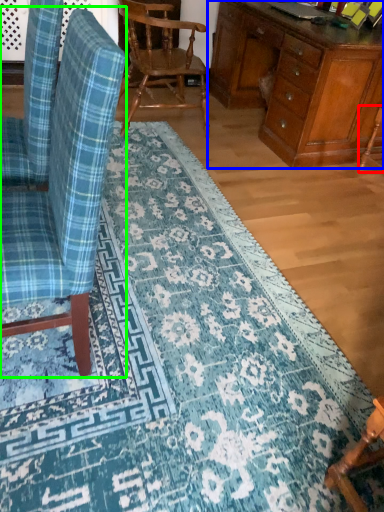
Question: Which is nearer to the armchair (highlighted by a red box)? desk (highlighted by a blue box) or chair (highlighted by a green box).

Choices:
 (A) desk
 (B) chair

Answer: (A)